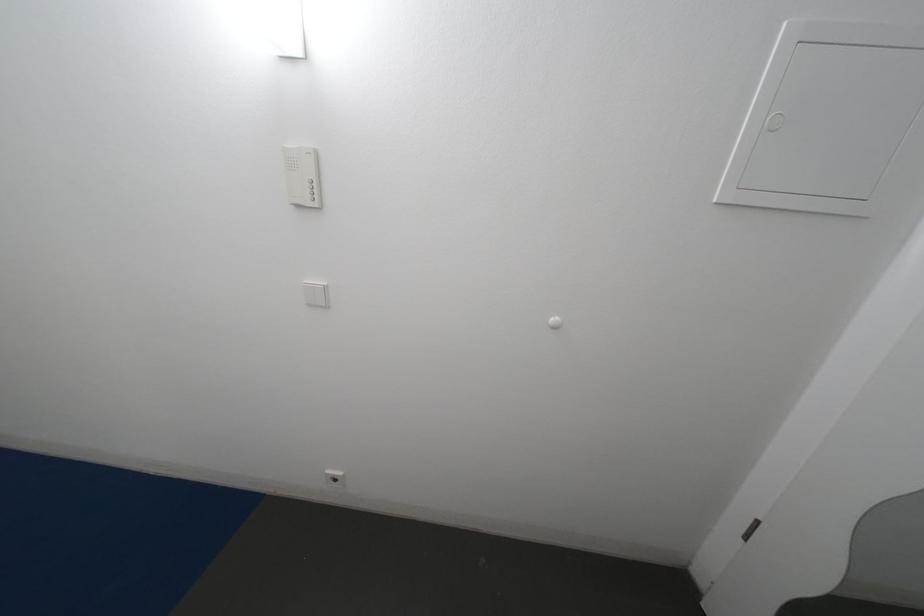
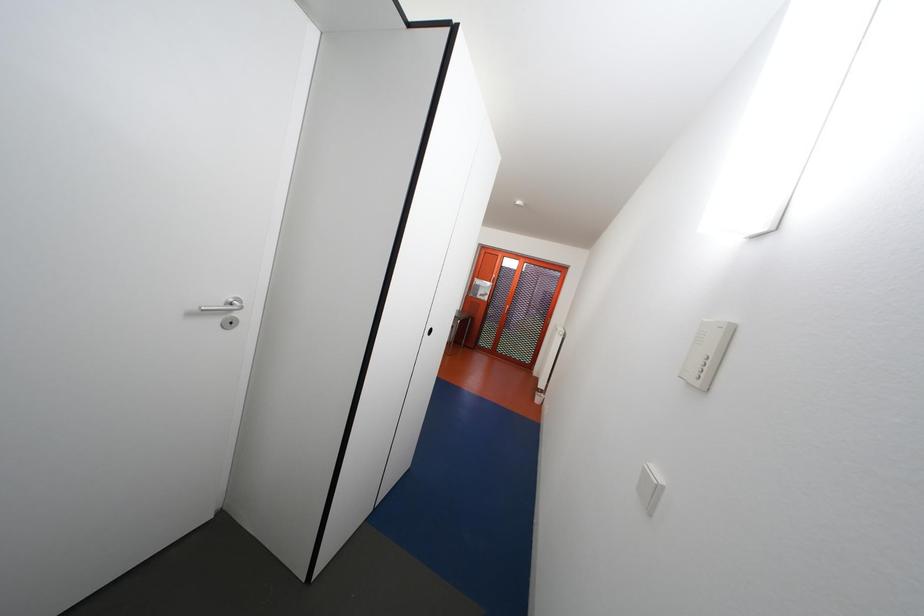
Question: The images are taken continuously from a first-person perspective. In which direction is your viewpoint rotating?

Choices:
 (A) Left
 (B) Right
 (C) Up
 (D) Down

Answer: (A)